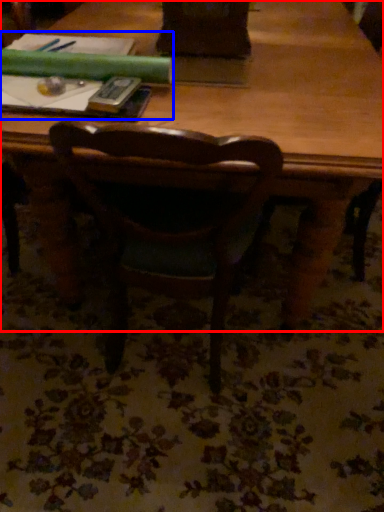
Question: Which object appears closest to the camera in this image, table (highlighted by a red box) or book (highlighted by a blue box)?

Choices:
 (A) table
 (B) book

Answer: (A)